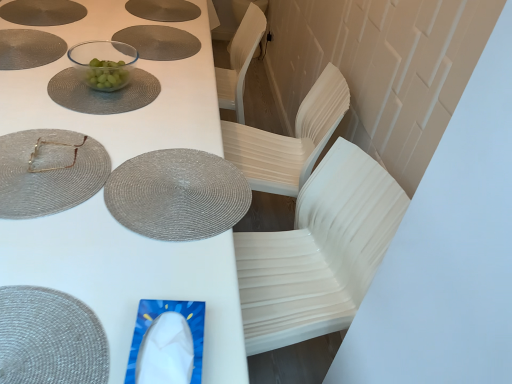
This screenshot has height=384, width=512. What are the coordinates of `free space above silver textured placemat at center, which is counted as the 2th tableware, starting from the bottom (from a real-world perspective)` in the screenshot? It's located at (176, 181).